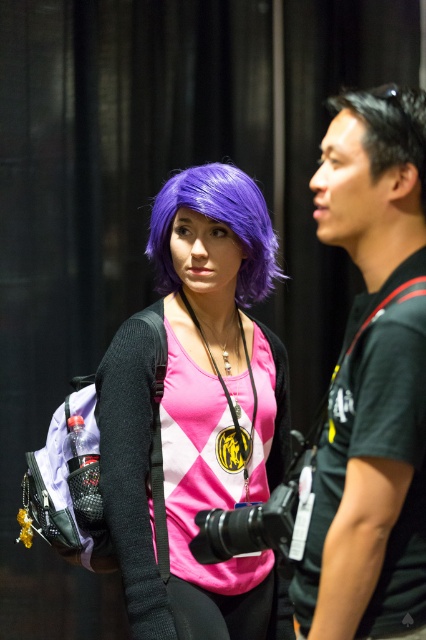
Question: Which of these objects is positioned closest to the black matte shirt at right?

Choices:
 (A) black shiny hair at upper right
 (B) purple synthetic wig at center
 (C) purple matte wig at center

Answer: (A)

Question: Which of the following is the farthest from the observer?

Choices:
 (A) (249, 296)
 (B) (279, 476)
 (C) (373, 173)

Answer: (B)

Question: Is the position of black matte shirt at right more distant than that of black shiny hair at upper right?

Choices:
 (A) no
 (B) yes

Answer: (A)

Question: Observing the image, what is the correct spatial positioning of purple matte wig at center in reference to black shiny hair at upper right?

Choices:
 (A) left
 (B) right

Answer: (A)

Question: Which point is closer to the camera taking this photo?

Choices:
 (A) (365, 371)
 (B) (164, 262)
 (C) (287, 449)

Answer: (A)

Question: Where is purple matte wig at center located in relation to black shiny hair at upper right in the image?

Choices:
 (A) left
 (B) right

Answer: (A)